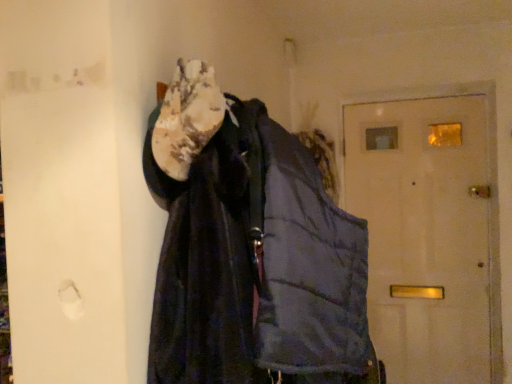
Question: Is dark blue quilted jacket at center positioned in front of white matte door at center?

Choices:
 (A) yes
 (B) no

Answer: (A)

Question: Is dark blue quilted jacket at center oriented away from white matte door at center?

Choices:
 (A) no
 (B) yes

Answer: (A)

Question: Is dark blue quilted jacket at center positioned beyond the bounds of white matte door at center?

Choices:
 (A) yes
 (B) no

Answer: (A)

Question: From a real-world perspective, is dark blue quilted jacket at center positioned under white matte door at center based on gravity?

Choices:
 (A) yes
 (B) no

Answer: (B)

Question: Can you confirm if dark blue quilted jacket at center is shorter than white matte door at center?

Choices:
 (A) no
 (B) yes

Answer: (B)

Question: Looking at their shapes, would you say dark blue quilted jacket at center is wider or thinner than white fuzzy scarf at upper center?

Choices:
 (A) thin
 (B) wide

Answer: (B)

Question: Is dark blue quilted jacket at center situated inside white fuzzy scarf at upper center or outside?

Choices:
 (A) outside
 (B) inside

Answer: (A)

Question: From a real-world perspective, is dark blue quilted jacket at center physically located above or below white fuzzy scarf at upper center?

Choices:
 (A) above
 (B) below

Answer: (B)

Question: In the image, is dark blue quilted jacket at center on the left side or the right side of white fuzzy scarf at upper center?

Choices:
 (A) right
 (B) left

Answer: (A)

Question: Considering the relative positions of white fuzzy scarf at upper center and white matte door at center in the image provided, is white fuzzy scarf at upper center to the left or to the right of white matte door at center?

Choices:
 (A) right
 (B) left

Answer: (B)

Question: Is point (217, 102) positioned closer to the camera than point (437, 190)?

Choices:
 (A) closer
 (B) farther

Answer: (A)

Question: Considering the positions of white fuzzy scarf at upper center and white matte door at center in the image, is white fuzzy scarf at upper center bigger or smaller than white matte door at center?

Choices:
 (A) small
 (B) big

Answer: (A)

Question: From a real-world perspective, is white fuzzy scarf at upper center physically located above or below white matte door at center?

Choices:
 (A) above
 (B) below

Answer: (A)

Question: Visually, is white fuzzy scarf at upper center positioned to the left or to the right of dark blue quilted jacket at center?

Choices:
 (A) left
 (B) right

Answer: (A)

Question: From a real-world perspective, relative to dark blue quilted jacket at center, is white fuzzy scarf at upper center vertically above or below?

Choices:
 (A) below
 (B) above

Answer: (B)